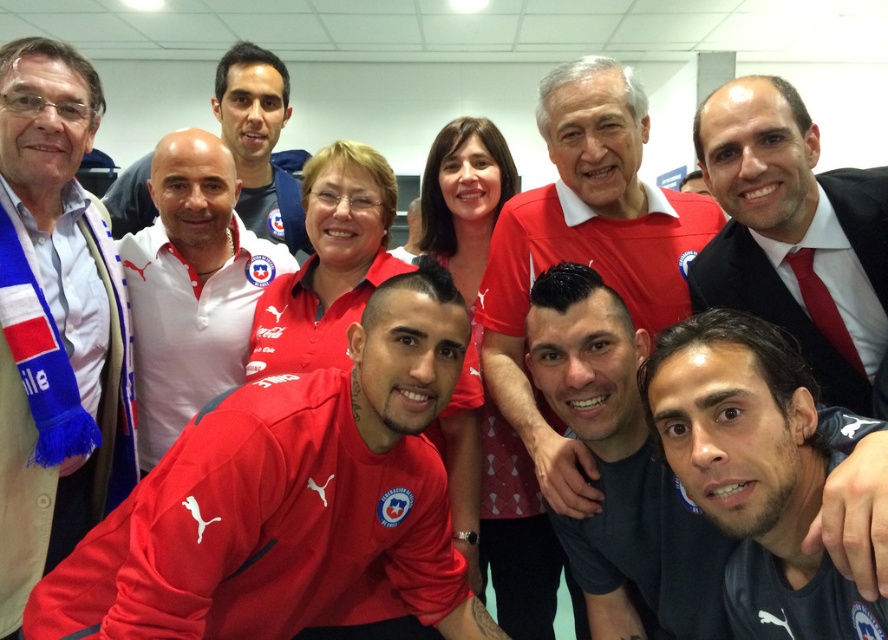
Question: Does matte red jersey at center appear on the left side of white matte shirt at center?

Choices:
 (A) no
 (B) yes

Answer: (A)

Question: Which object appears closest to the camera in this image?

Choices:
 (A) dark blue jersey at center
 (B) matte white shirt at center

Answer: (A)

Question: Does dark blue jersey at center have a greater width compared to matte black suit at right?

Choices:
 (A) no
 (B) yes

Answer: (A)

Question: Which point is farther to the camera?

Choices:
 (A) matte black suit at right
 (B) matte red jersey at center
 (C) matte red shirt at center
 (D) matte white shirt at center

Answer: (D)

Question: Which is nearer to the dark blue jersey at center?

Choices:
 (A) white matte shirt at center
 (B) white fabric scarf at upper left
 (C) matte black suit at right

Answer: (C)

Question: From the image, what is the correct spatial relationship of white fabric scarf at upper left in relation to matte black suit at right?

Choices:
 (A) left
 (B) right

Answer: (A)